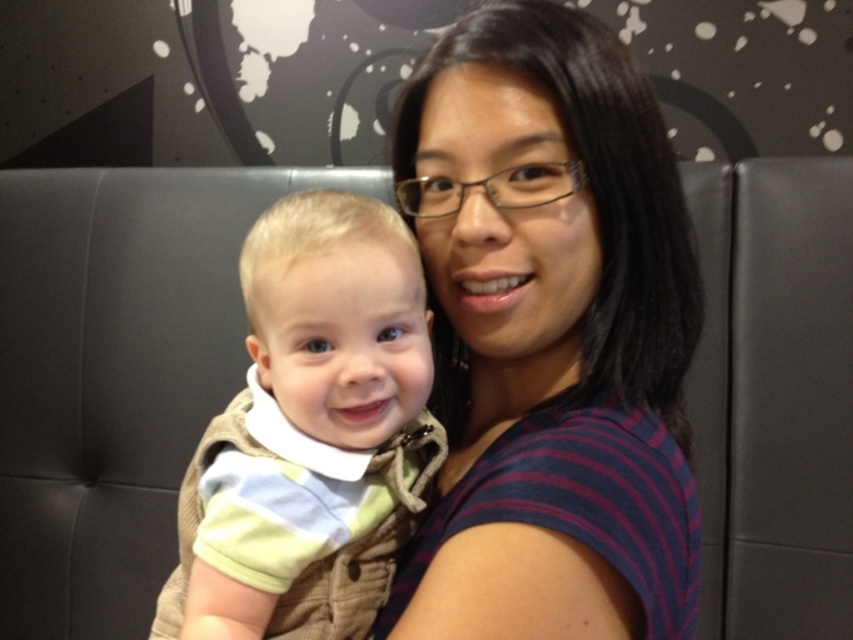
You are a photographer trying to decide where to place a small decorative item in the scene. The item is the size of the striped fabric baby at left. You want to place it next to the striped fabric shirt at center. Will the item fit comfortably next to the shirt without overlapping?

The striped fabric shirt at center is bigger than the striped fabric baby at left. Since the item is the size of the baby, it will fit comfortably next to the shirt without overlapping because the shirt is larger.

You are a photographer adjusting the focus on your camera. You need to focus on the two points in the image, point 1 at coordinates point (x=635, y=428) and point 2 at coordinates point (x=349, y=346). Which point should you focus on first to ensure proper depth of field?

You should focus on point (x=635, y=428) first because it is closer to the viewer than point (x=349, y=346), ensuring proper depth of field.

You are a photographer trying to focus on the striped fabric shirt at center in the image. The camera shows a grid with a point at coordinate (556, 330). Is this point likely indicating the correct position for the shirt?

Yes, the point at (556, 330) corresponds to the striped fabric shirt at center, so the camera is correctly focused on the striped fabric shirt at center.